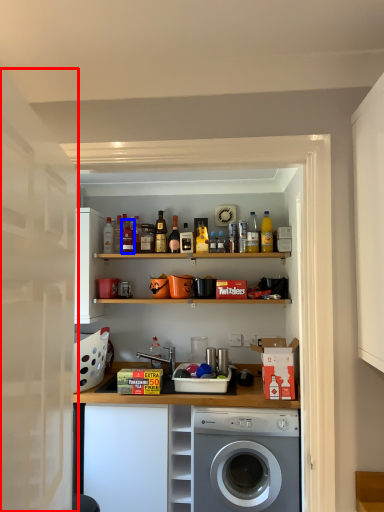
Question: Which point is further to the camera, door (highlighted by a red box) or bottle (highlighted by a blue box)?

Choices:
 (A) door
 (B) bottle

Answer: (B)